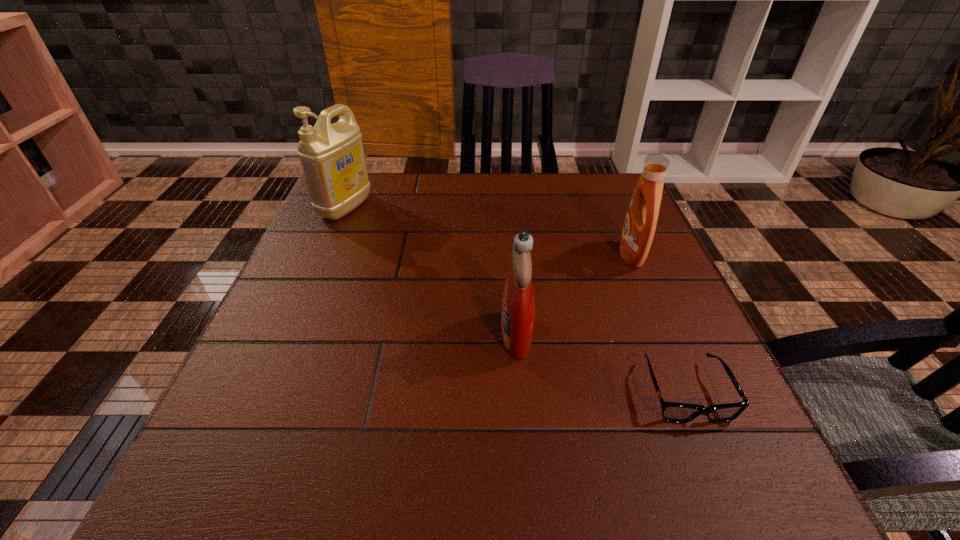
Image resolution: width=960 pixels, height=540 pixels. In order to click on free spot located on the front-facing side of the rightmost detergent in this screenshot , I will do `click(538, 255)`.

Where is `blank space located 0.220m on the front surface of the second detergent from right to left`? blank space located 0.220m on the front surface of the second detergent from right to left is located at coordinates (384, 334).

Identify the location of vacant space located 0.050m on the front surface of the second detergent from right to left. This screenshot has width=960, height=540. click(474, 334).

Identify the location of vacant space located on the front surface of the second detergent from right to left. (453, 334).

The width and height of the screenshot is (960, 540). I want to click on vacant point located on the front-facing side of the sunglasses, so click(715, 464).

The height and width of the screenshot is (540, 960). I want to click on object that is positioned at the far edge, so click(332, 156).

Find the location of a particular element. The width and height of the screenshot is (960, 540). object that is at the left edge is located at coordinates (332, 156).

At what (x,y) coordinates should I click in order to perform the action: click on detergent present at the right edge. Please return your answer as a coordinate pair (x, y). The image size is (960, 540). Looking at the image, I should click on (639, 228).

Where is `sunglasses that is at the right edge`? sunglasses that is at the right edge is located at coordinates (673, 412).

Where is `object at the far left corner`? The height and width of the screenshot is (540, 960). object at the far left corner is located at coordinates (332, 156).